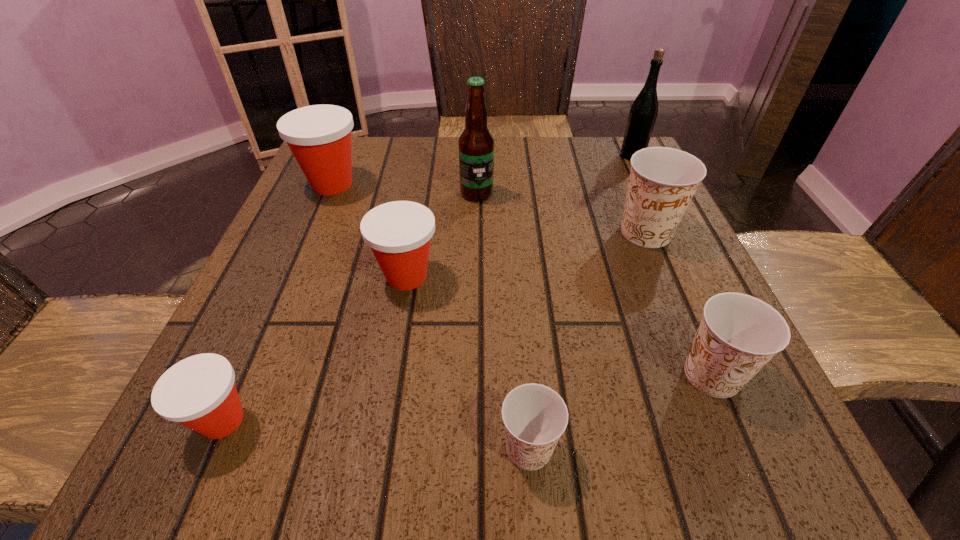
This screenshot has height=540, width=960. Identify the location of the farther beer bottle. (643, 113).

This screenshot has width=960, height=540. I want to click on green beer bottle, so click(643, 113).

This screenshot has height=540, width=960. In order to click on the nearer beer bottle in this screenshot , I will do `click(476, 144)`.

What are the coordinates of `brown beer bottle` in the screenshot? It's located at coord(476,144).

Find the location of a particular element. The image size is (960, 540). the farthest red-orange Dixie cup is located at coordinates (319, 136).

Image resolution: width=960 pixels, height=540 pixels. I want to click on the biggest red-orange Dixie cup, so click(x=319, y=136).

Locate an element on the screen. This screenshot has height=540, width=960. the fifth nearest Dixie cup is located at coordinates (663, 180).

The image size is (960, 540). Identify the location of the biggest orange Dixie cup. (663, 180).

Where is `the rightmost red-orange Dixie cup`? the rightmost red-orange Dixie cup is located at coordinates (399, 233).

Identify the location of the second nearest red-orange Dixie cup. The width and height of the screenshot is (960, 540). (399, 233).